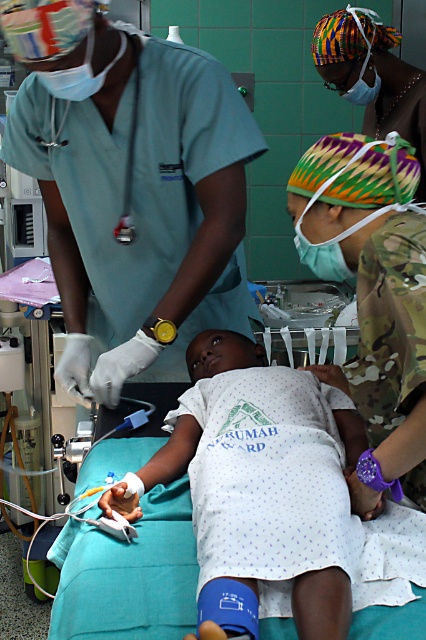
Question: Which object appears farthest from the camera in this image?

Choices:
 (A) white dotted fabric at center
 (B) camouflage fabric soldier at center

Answer: (A)

Question: Can you confirm if camouflage fabric soldier at center is positioned to the right of white dotted fabric at center?

Choices:
 (A) yes
 (B) no

Answer: (B)

Question: Among these points, which one is farthest from the camera?

Choices:
 (A) (294, 598)
 (B) (379, 61)

Answer: (B)

Question: Which object appears farthest from the camera in this image?

Choices:
 (A) white dotted fabric at center
 (B) camouflage fabric soldier at center
 (C) multicolored woven headwrap at upper right

Answer: (C)

Question: Is camouflage fabric soldier at center wider than multicolored woven headwrap at upper right?

Choices:
 (A) no
 (B) yes

Answer: (B)

Question: Is camouflage fabric soldier at center wider than white dotted fabric at center?

Choices:
 (A) yes
 (B) no

Answer: (A)